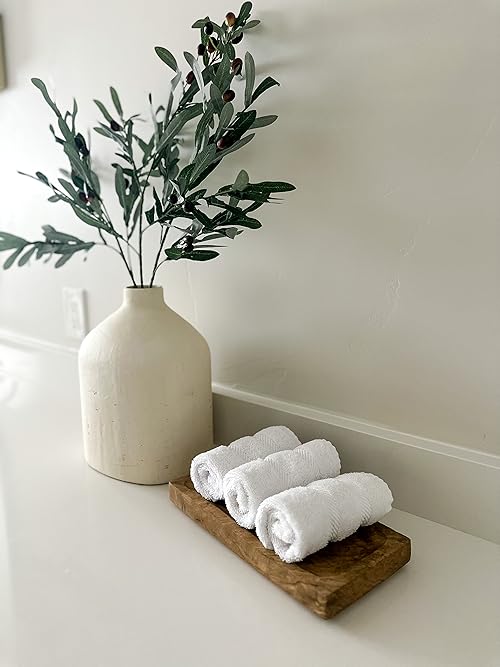
Where is `middle hand towel`? middle hand towel is located at coordinates (307, 465).